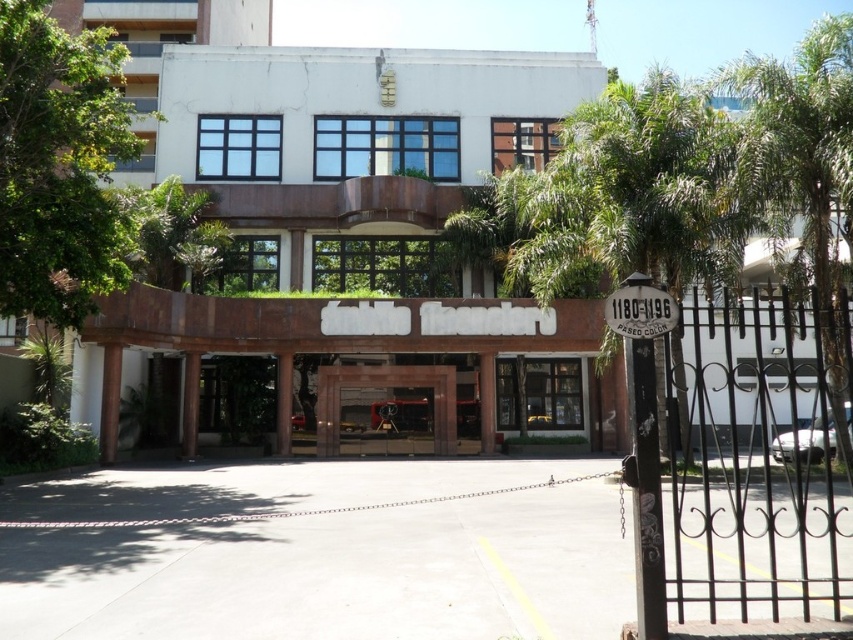
You are standing at the entrance of Fondo Financiero and want to know the distance between the green leafy palm tree at right and the clear glass window at upper center. Can you estimate how far apart they are?

The green leafy palm tree at right is 27.89 meters away from the clear glass window at upper center.

You are standing in front of the building and want to take a photo of the brown stone gate at center without the green leafy palm tree at right blocking the view. Is there a position where you can stand to achieve this?

The green leafy palm tree at right might be wider than the brown stone gate at center, so there might not be a position where you can fully avoid the palm tree blocking the gate. You might need to move closer or adjust your angle to minimize the obstruction.